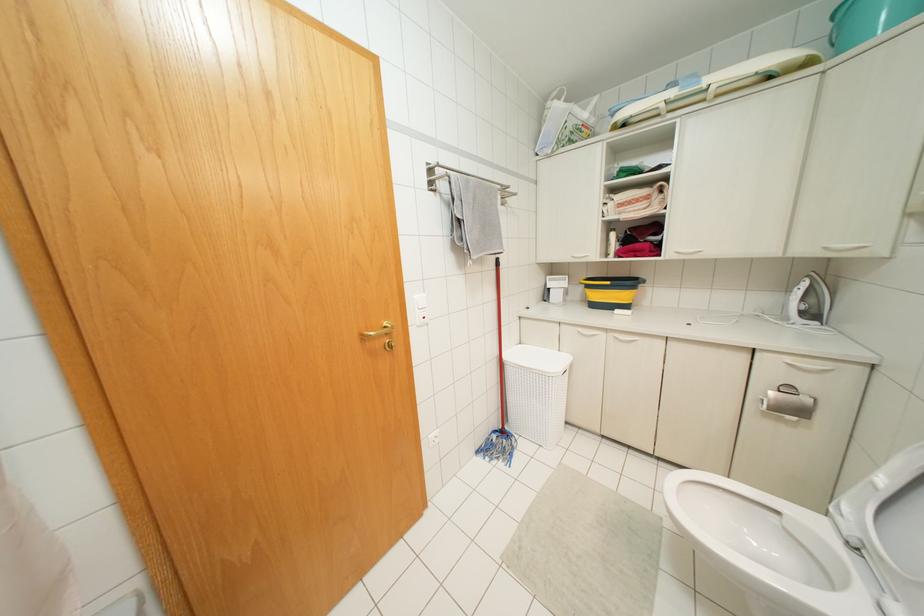
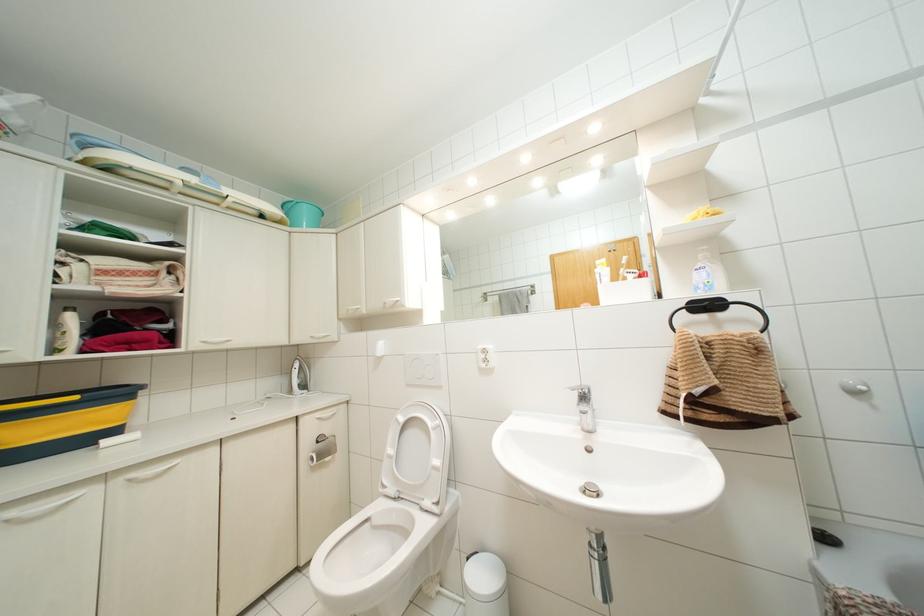
Find the pixel in the second image that matches (882,480) in the first image.

(390, 450)